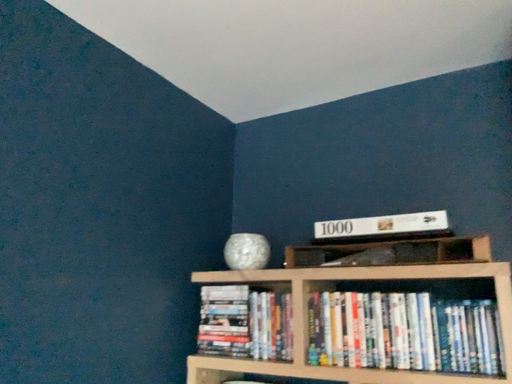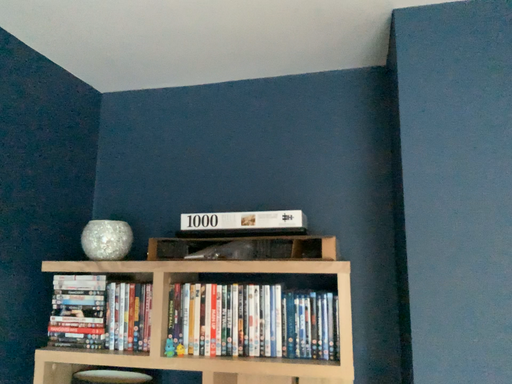
Question: How did the camera likely rotate when shooting the video?

Choices:
 (A) rotated left
 (B) rotated right

Answer: (B)